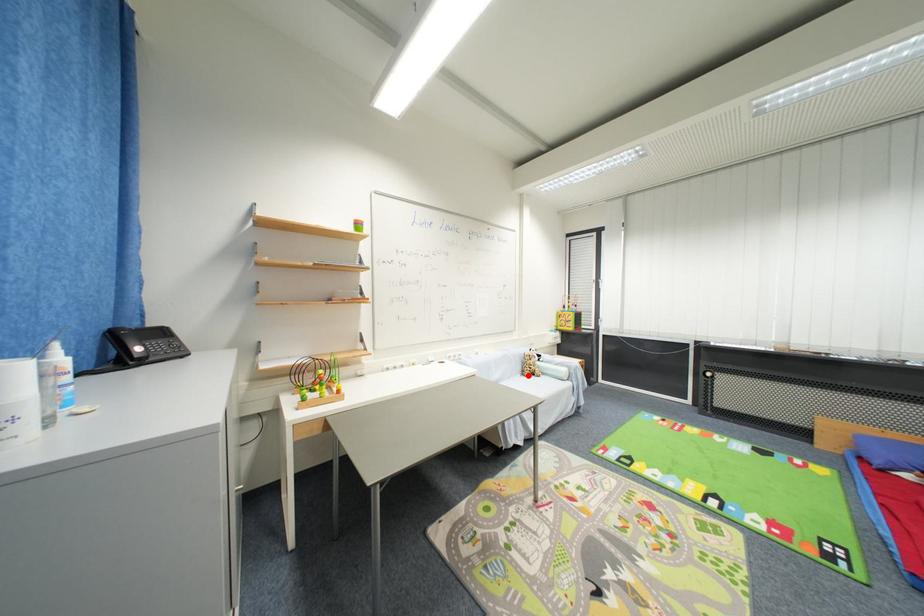
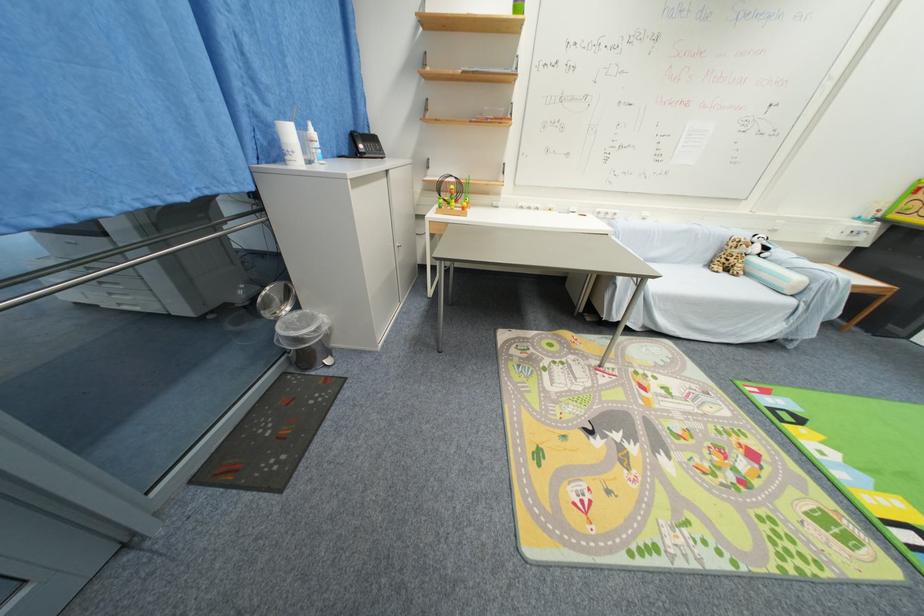
Question: I am providing you with two images of the same scene from different viewpoints. Given a red point in image1, look at the same physical point in image2. Is it:

Choices:
 (A) Closer to the viewpoint
 (B) Farther from the viewpoint

Answer: (A)